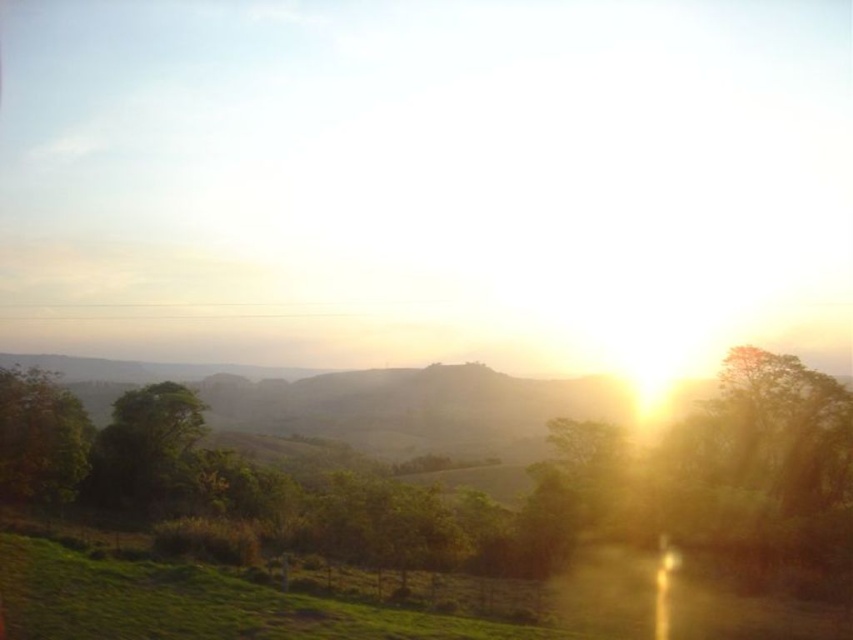
Question: Is green leafy tree at left wider than green matte tree at left?

Choices:
 (A) no
 (B) yes

Answer: (A)

Question: Which point appears farthest from the camera in this image?

Choices:
 (A) (96, 476)
 (B) (25, 392)

Answer: (A)

Question: Among these objects, which one is nearest to the camera?

Choices:
 (A) green matte tree at left
 (B) green leafy tree at left

Answer: (A)

Question: Does green leafy tree at left have a greater width compared to green matte tree at left?

Choices:
 (A) yes
 (B) no

Answer: (B)

Question: Can you confirm if green leafy tree at left is positioned to the right of green matte tree at left?

Choices:
 (A) yes
 (B) no

Answer: (A)